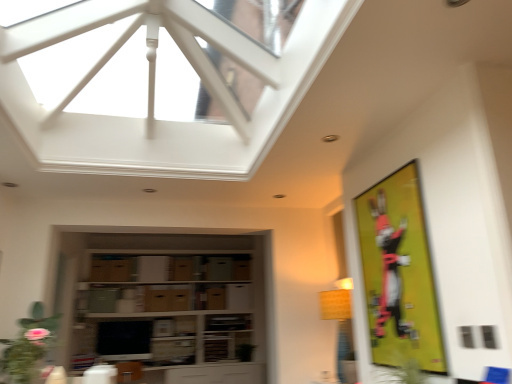
Question: Is yellow matte bulletin board at right placed right next to green matte plant at lower left?

Choices:
 (A) no
 (B) yes

Answer: (A)

Question: Are yellow matte bulletin board at right and green matte plant at lower left located far from each other?

Choices:
 (A) yes
 (B) no

Answer: (A)

Question: From a real-world perspective, is yellow matte bulletin board at right located higher than green matte plant at lower left?

Choices:
 (A) no
 (B) yes

Answer: (B)

Question: Is yellow matte bulletin board at right thinner than green matte plant at lower left?

Choices:
 (A) no
 (B) yes

Answer: (B)

Question: From the image's perspective, would you say yellow matte bulletin board at right is shown under green matte plant at lower left?

Choices:
 (A) yes
 (B) no

Answer: (B)

Question: Visually, is matte black monitor at center positioned to the left or to the right of white glass window at upper center?

Choices:
 (A) right
 (B) left

Answer: (B)

Question: Based on their sizes in the image, would you say matte black monitor at center is bigger or smaller than white glass window at upper center?

Choices:
 (A) big
 (B) small

Answer: (B)

Question: Is matte black monitor at center wider or thinner than white glass window at upper center?

Choices:
 (A) wide
 (B) thin

Answer: (B)

Question: Choose the correct answer: Is matte black monitor at center inside white glass window at upper center or outside it?

Choices:
 (A) inside
 (B) outside

Answer: (B)

Question: Which is correct: matte black monitor at center is inside yellow matte bulletin board at right, or outside of it?

Choices:
 (A) inside
 (B) outside

Answer: (B)

Question: Looking at the image, does matte black monitor at center seem bigger or smaller compared to yellow matte bulletin board at right?

Choices:
 (A) big
 (B) small

Answer: (A)

Question: From their relative heights in the image, would you say matte black monitor at center is taller or shorter than yellow matte bulletin board at right?

Choices:
 (A) tall
 (B) short

Answer: (B)

Question: Relative to yellow matte bulletin board at right, is matte black monitor at center in front or behind?

Choices:
 (A) front
 (B) behind

Answer: (B)

Question: Looking at the image, does yellow matte bulletin board at right seem bigger or smaller compared to white glass window at upper center?

Choices:
 (A) big
 (B) small

Answer: (B)

Question: Considering the positions of yellow matte bulletin board at right and white glass window at upper center in the image, is yellow matte bulletin board at right wider or thinner than white glass window at upper center?

Choices:
 (A) thin
 (B) wide

Answer: (A)